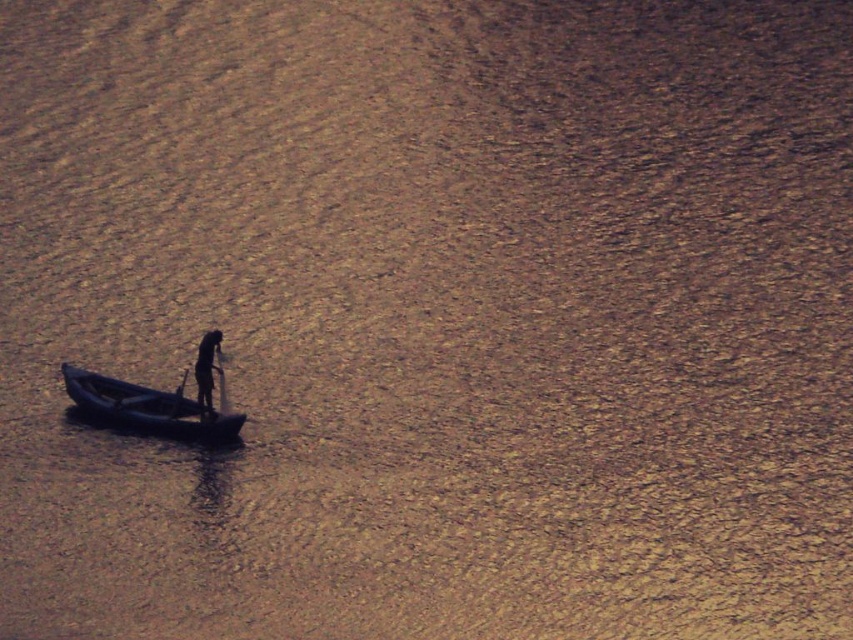
You are a photographer trying to capture a closeup of the black matte person at center and the black plastic paddle at center. Your camera has a minimum focusing distance of 20 inches. Can you take the closeup without moving the camera?

The black matte person at center is 22.27 inches away from the black plastic paddle at center. Since the minimum focusing distance is 20 inches, the camera can focus on both objects as they are within the required distance.

You are a photographer positioned at the camera location. You want to capture a closeup shot of the blue rubber canoe at center. Considering the distance, do you think you can walk towards it to get closer without using any equipment?

The distance between the blue rubber canoe at center and the camera is 25.27 meters. Walking this distance is possible, so you can move closer to the canoe to take the closeup shot.

You are a photographer trying to capture the blue rubber canoe at center and the black matte person at center in the same frame. Based on their sizes in the image, which one will appear larger in your photo?

The blue rubber canoe at center is bigger than the black matte person at center, so it will appear larger in the photo.